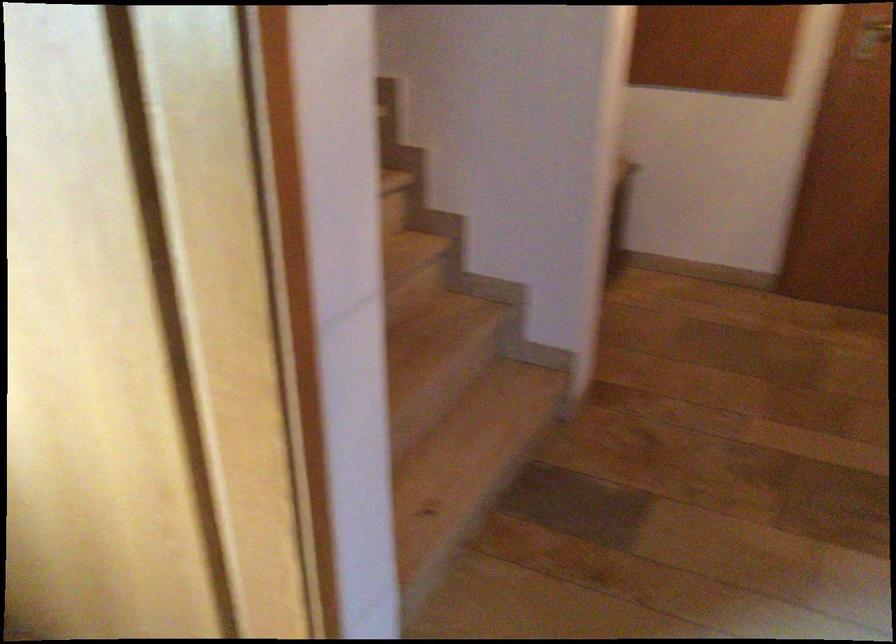
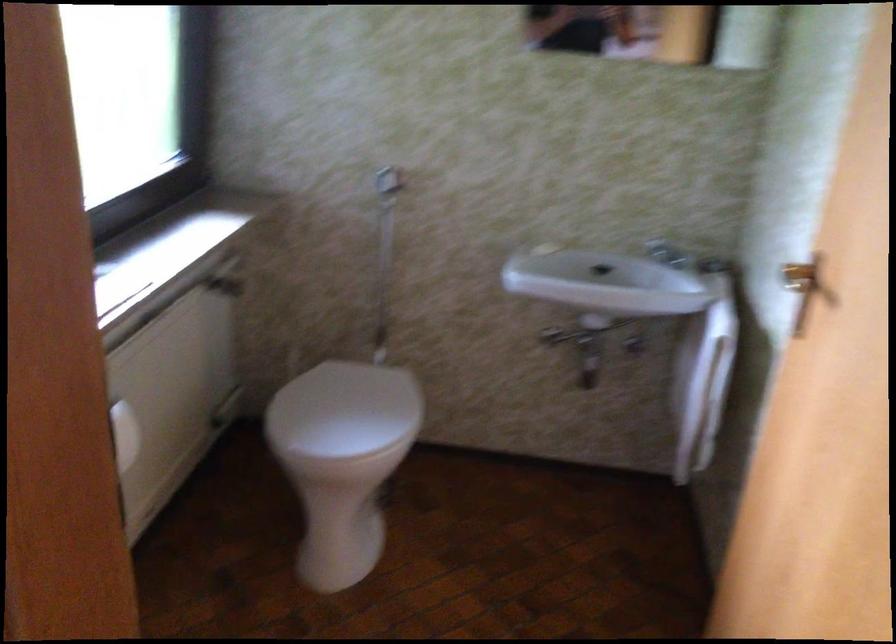
Question: The camera is either moving clockwise (left) or counter-clockwise (right) around the object. The first image is from the beginning of the video and the second image is from the end. Is the camera moving left or right when shooting the video?

Choices:
 (A) Left
 (B) Right

Answer: (B)